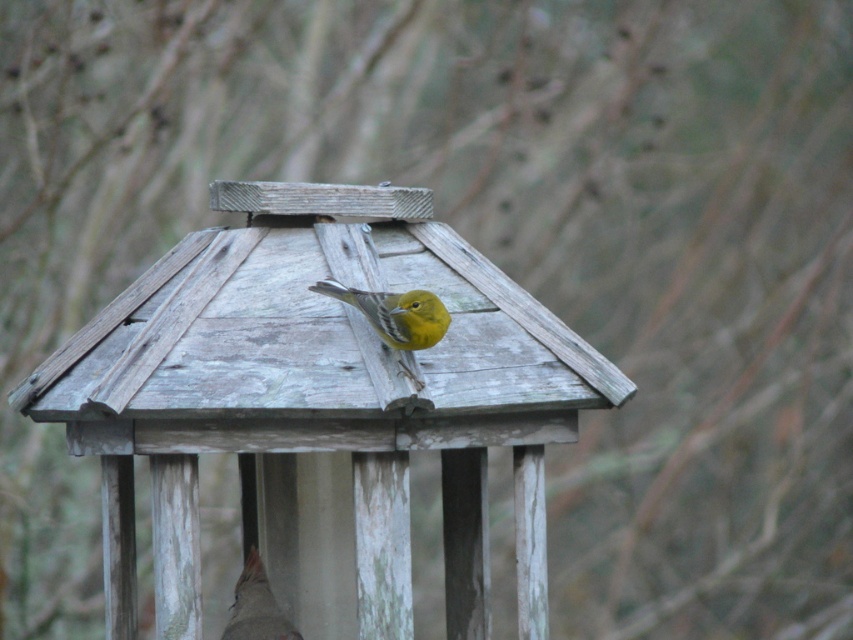
Question: Does weathered wood bird feeder at center have a larger size compared to matte brown bird at center?

Choices:
 (A) no
 (B) yes

Answer: (B)

Question: Which point is farther to the camera?

Choices:
 (A) yellow matte bird at center
 (B) matte brown bird at center

Answer: (B)

Question: Which point is closer to the camera taking this photo?

Choices:
 (A) (390, 324)
 (B) (192, 260)
 (C) (253, 630)

Answer: (A)

Question: Can you confirm if weathered wood bird feeder at center is wider than matte brown bird at center?

Choices:
 (A) no
 (B) yes

Answer: (B)

Question: In this image, where is yellow matte bird at center located relative to matte brown bird at center?

Choices:
 (A) left
 (B) right

Answer: (B)

Question: Based on their relative distances, which object is farther from the matte brown bird at center?

Choices:
 (A) weathered wood bird feeder at center
 (B) yellow matte bird at center

Answer: (B)